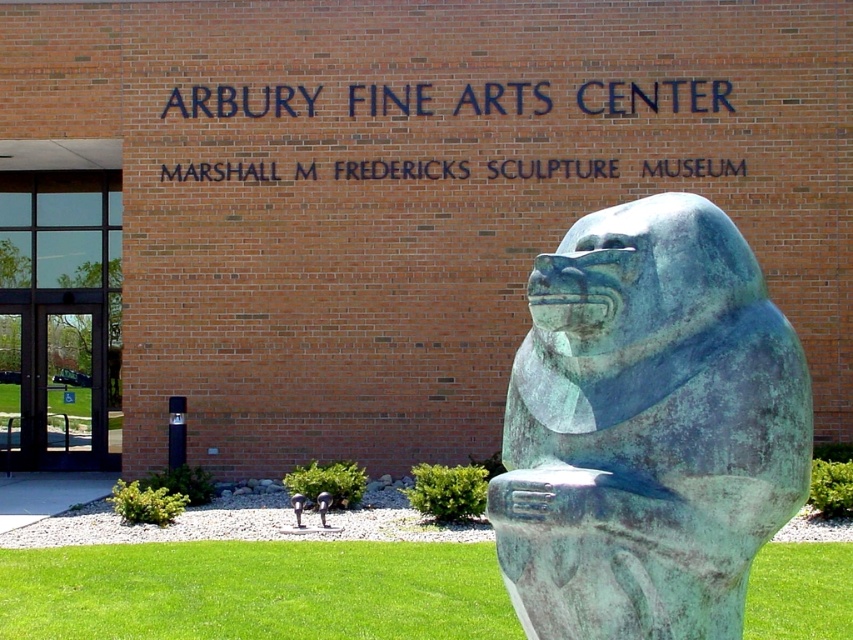
Question: Among these points, which one is farthest from the camera?

Choices:
 (A) (67, 394)
 (B) (576, 435)

Answer: (A)

Question: Is green patina stone statue at center further to the viewer compared to clear glass door at left?

Choices:
 (A) yes
 (B) no

Answer: (B)

Question: Among these points, which one is nearest to the camera?

Choices:
 (A) (575, 300)
 (B) (84, 179)

Answer: (A)

Question: Is green patina stone statue at center smaller than clear glass door at left?

Choices:
 (A) yes
 (B) no

Answer: (A)

Question: Does green patina stone statue at center have a lesser width compared to clear glass door at left?

Choices:
 (A) no
 (B) yes

Answer: (B)